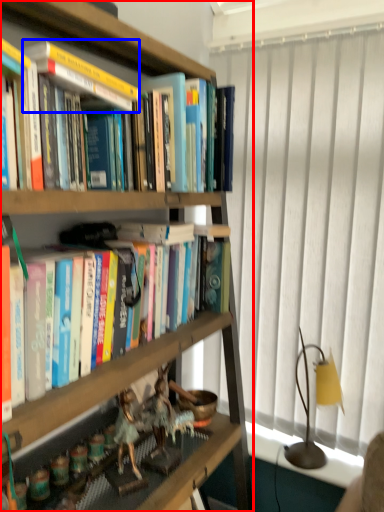
Question: Which point is further to the camera, bookcase (highlighted by a red box) or paperback book (highlighted by a blue box)?

Choices:
 (A) bookcase
 (B) paperback book

Answer: (B)